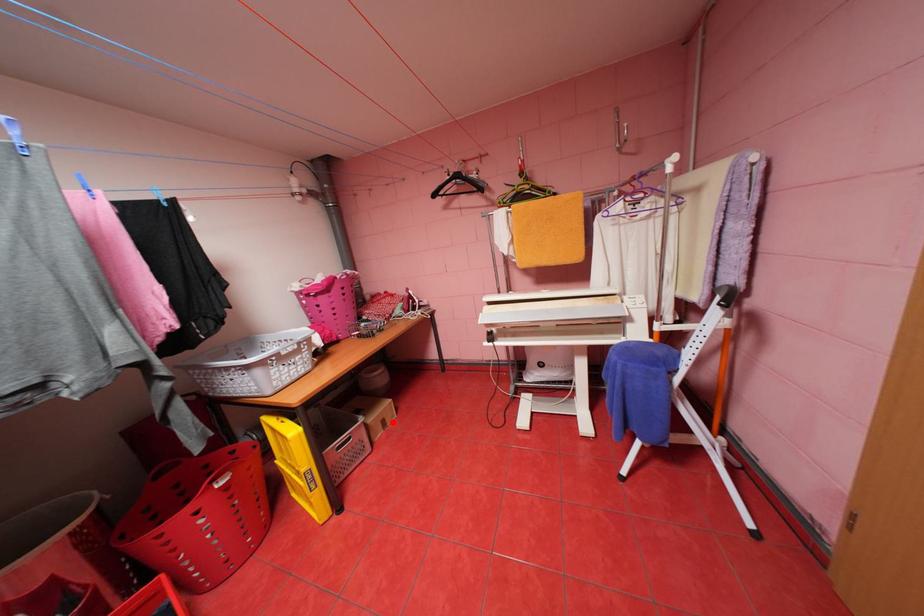
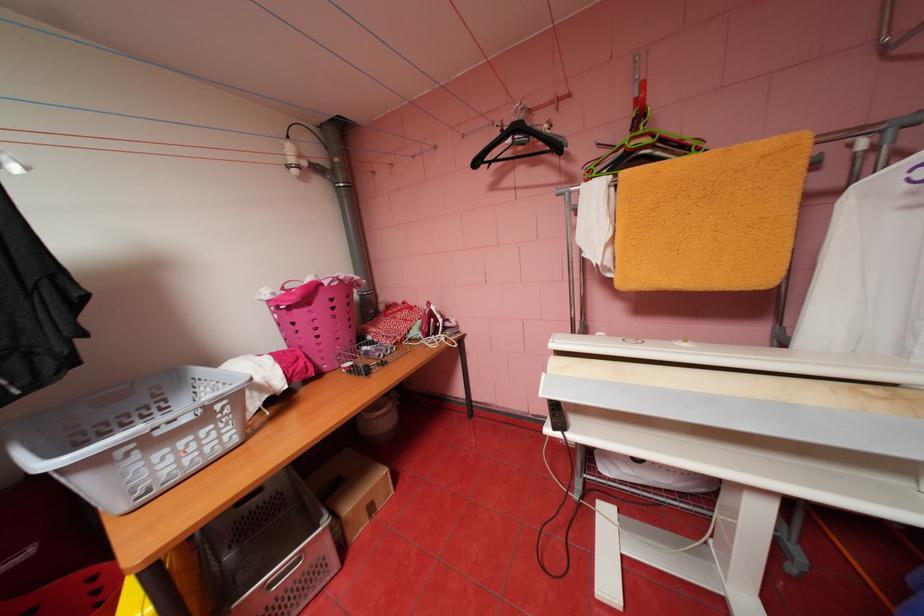
The point at the highlighted location is marked in the first image. Where is the corresponding point in the second image?

(380, 508)